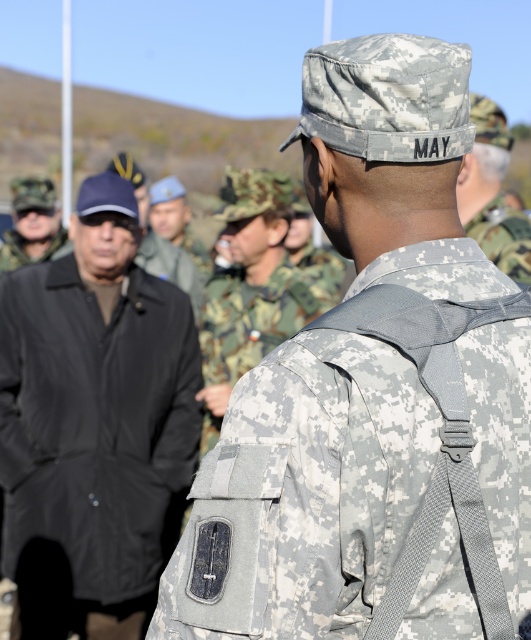
Question: Where is camouflage fabric backpack at center located in relation to camouflage fabric backpack at upper center in the image?

Choices:
 (A) above
 (B) below

Answer: (B)

Question: Does black matte coat at left lie in front of camouflage uniform at center?

Choices:
 (A) no
 (B) yes

Answer: (A)

Question: Among these points, which one is nearest to the camera?

Choices:
 (A) (509, 216)
 (B) (271, 346)

Answer: (A)

Question: Which of the following is the farthest from the observer?

Choices:
 (A) camouflage fabric backpack at upper center
 (B) camouflage uniform at center
 (C) digital camouflage uniform at center
 (D) matte black jacket at left

Answer: (D)

Question: Which point appears farthest from the camera in this image?

Choices:
 (A) (8, 257)
 (B) (22, 241)
 (C) (472, 499)
 (D) (502, 248)

Answer: (B)

Question: Is camouflage uniform at center below camouflage fabric uniform at center?

Choices:
 (A) yes
 (B) no

Answer: (A)